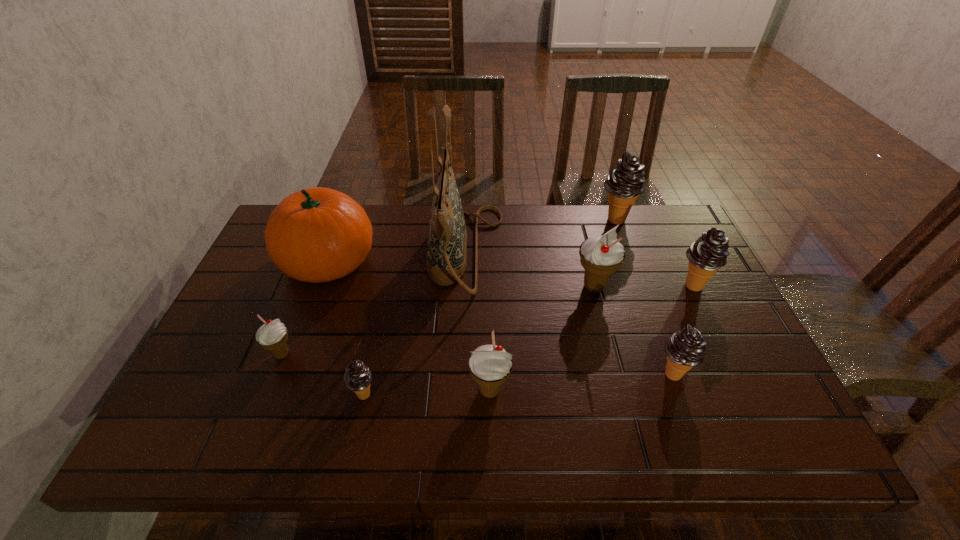
Locate an element on the screen. This screenshot has width=960, height=540. object located in the far right corner section of the desktop is located at coordinates (625, 182).

Where is `free space at the far edge of the desktop`? The height and width of the screenshot is (540, 960). free space at the far edge of the desktop is located at coordinates (636, 233).

In the image, there is a desktop. Where is `vacant space at the near edge`? Image resolution: width=960 pixels, height=540 pixels. vacant space at the near edge is located at coordinates (442, 446).

Where is `vacant space at the right edge of the desktop`? Image resolution: width=960 pixels, height=540 pixels. vacant space at the right edge of the desktop is located at coordinates (764, 370).

In the image, there is a desktop. Where is `vacant space at the far right corner`? vacant space at the far right corner is located at coordinates (665, 237).

You are a GUI agent. You are given a task and a screenshot of the screen. Output one action in this format:
    pyautogui.click(x=<x>, y=<y>)
    Task: Click on the vacant area that lies between the tallest object and the pumpkin
    This screenshot has width=960, height=540.
    Given the screenshot: What is the action you would take?
    pyautogui.click(x=397, y=256)

Locate an element on the screen. free spot between the pumpkin and the second nearest white icecream is located at coordinates (305, 307).

Where is `empty space between the second biggest chocolate icecream and the third biggest chocolate icecream`? The height and width of the screenshot is (540, 960). empty space between the second biggest chocolate icecream and the third biggest chocolate icecream is located at coordinates (683, 329).

At what (x,y) coordinates should I click in order to perform the action: click on unoccupied position between the second smallest chocolate icecream and the farthest chocolate icecream. Please return your answer as a coordinate pair (x, y). This screenshot has width=960, height=540. Looking at the image, I should click on (644, 296).

Find the location of a particular element. vacant point located between the rightmost chocolate icecream and the farthest icecream is located at coordinates (655, 252).